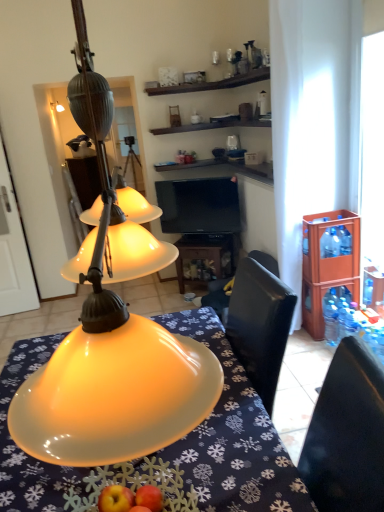
Question: Is black glossy tv at center facing towards blue plastic bottles at right, which is the second bottle from bottom to top?

Choices:
 (A) yes
 (B) no

Answer: (B)

Question: From a real-world perspective, is black glossy tv at center under blue plastic bottles at right, the 2th bottle when ordered from top to bottom?

Choices:
 (A) no
 (B) yes

Answer: (A)

Question: Can you confirm if black glossy tv at center is wider than blue plastic bottles at right, which is the second bottle from bottom to top?

Choices:
 (A) no
 (B) yes

Answer: (B)

Question: Considering the relative sizes of black glossy tv at center and blue plastic bottles at right, the 2th bottle when ordered from top to bottom, in the image provided, is black glossy tv at center taller than blue plastic bottles at right, the 2th bottle when ordered from top to bottom,?

Choices:
 (A) no
 (B) yes

Answer: (B)

Question: Is black glossy tv at center looking in the opposite direction of blue plastic bottles at right, which is the second bottle from bottom to top?

Choices:
 (A) no
 (B) yes

Answer: (A)

Question: Based on their positions, is blue plastic bottles at right, the 2th bottle when ordered from top to bottom, located to the left or right of matte yellow lampshade at center?

Choices:
 (A) left
 (B) right

Answer: (B)

Question: Considering the positions of blue plastic bottles at right, the 2th bottle when ordered from top to bottom, and matte yellow lampshade at center in the image, is blue plastic bottles at right, the 2th bottle when ordered from top to bottom, taller or shorter than matte yellow lampshade at center?

Choices:
 (A) short
 (B) tall

Answer: (A)

Question: Is point (345, 250) closer or farther from the camera than point (188, 315)?

Choices:
 (A) farther
 (B) closer

Answer: (A)

Question: From a real-world perspective, is blue plastic bottles at right, which is the second bottle from bottom to top, positioned above or below matte yellow lampshade at center?

Choices:
 (A) below
 (B) above

Answer: (B)

Question: From the image's perspective, relative to matte yellow lampshade at center, is brown wooden cabinet at right above or below?

Choices:
 (A) below
 (B) above

Answer: (B)

Question: In terms of width, does brown wooden cabinet at right look wider or thinner when compared to matte yellow lampshade at center?

Choices:
 (A) wide
 (B) thin

Answer: (B)

Question: From their relative heights in the image, would you say brown wooden cabinet at right is taller or shorter than matte yellow lampshade at center?

Choices:
 (A) short
 (B) tall

Answer: (B)

Question: In terms of size, does brown wooden cabinet at right appear bigger or smaller than matte yellow lampshade at center?

Choices:
 (A) big
 (B) small

Answer: (B)

Question: Considering the positions of matte yellow lampshade at center and transparent plastic bottle at right, which appears as the third bottle when viewed from the top, in the image, is matte yellow lampshade at center wider or thinner than transparent plastic bottle at right, which appears as the third bottle when viewed from the top,?

Choices:
 (A) thin
 (B) wide

Answer: (B)

Question: Does point (221, 345) appear closer or farther from the camera than point (332, 332)?

Choices:
 (A) farther
 (B) closer

Answer: (B)